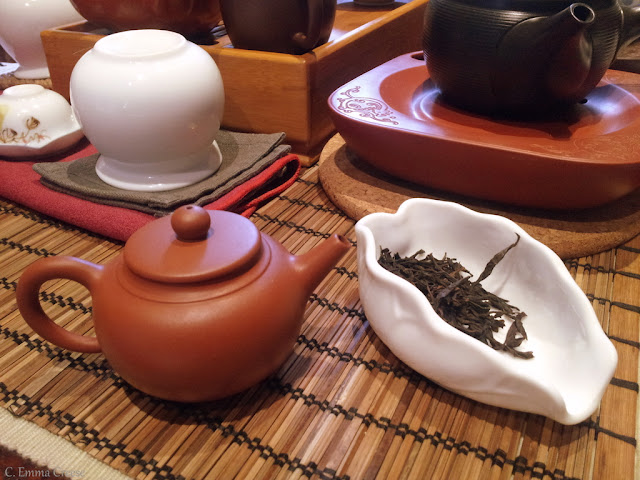
The image size is (640, 480). I want to click on black checker rows on table mat, so click(114, 449), click(232, 432), click(314, 398), click(345, 355), click(346, 314), click(347, 272), click(304, 222), click(320, 203), click(312, 185).